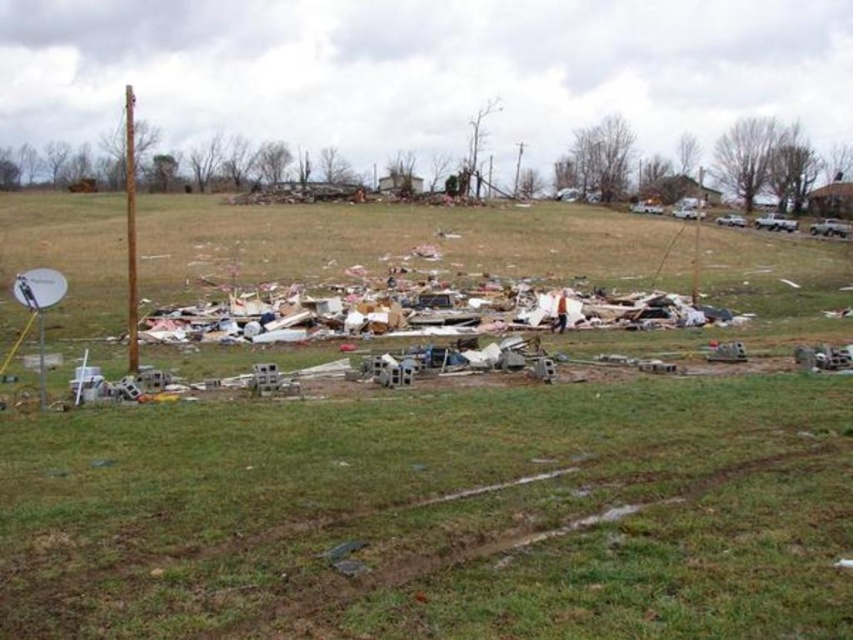
Is green grass at center further to the viewer compared to rusty metal pole at left?

No, green grass at center is closer to the viewer.

Does green grass at center appear on the left side of rusty metal pole at left?

Incorrect, green grass at center is not on the left side of rusty metal pole at left.

The height and width of the screenshot is (640, 853). In order to click on green grass at center in this screenshot , I will do `click(434, 513)`.

Where is `green grass at center`? green grass at center is located at coordinates (434, 513).